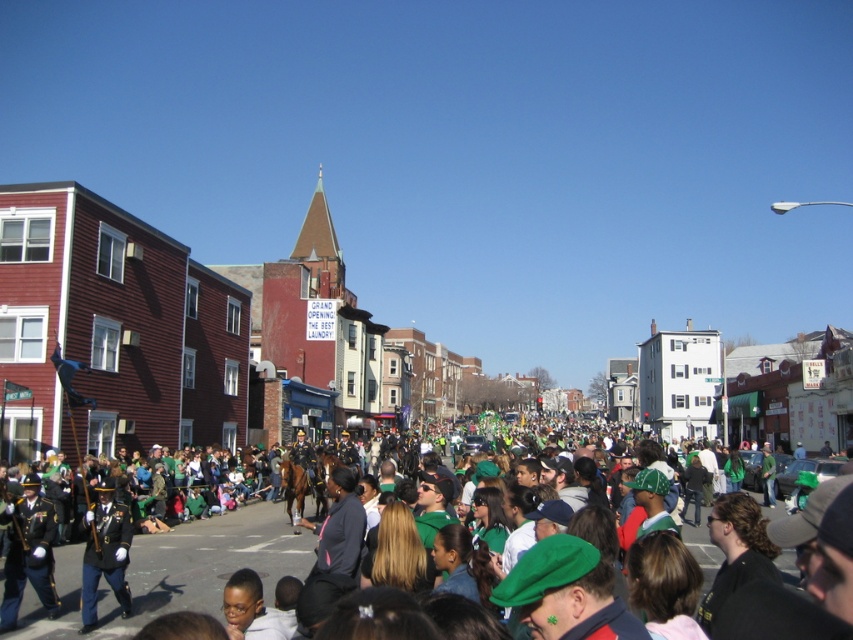
You are a photographer trying to capture the parade. You notice the green fabric flag at center and the shiny gold uniform at center. Which object should you focus on to ensure it fills more of your camera frame?

The green fabric flag at center has a larger size compared to the shiny gold uniform at center, so focusing on it will fill more of the camera frame.

You are a photographer trying to capture a photo of the shiny gold uniform at center and the green fabric flag at center during the parade. Based on their positions, which object should you focus on first to ensure both are in the frame?

The green fabric flag at center is located below the shiny gold uniform at center, so you should focus on the shiny gold uniform at center first to ensure both are in the frame.